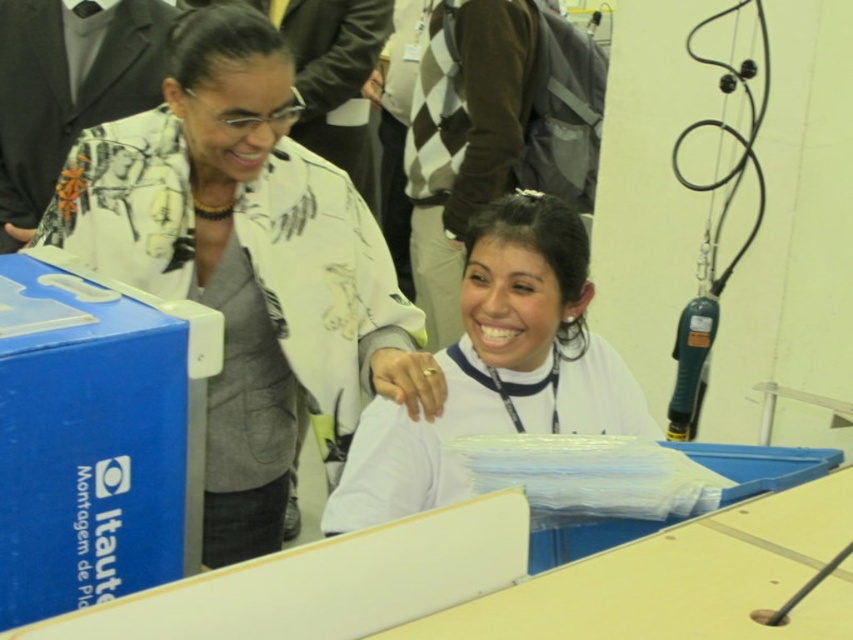
Question: Which point appears farthest from the camera in this image?

Choices:
 (A) (395, 499)
 (B) (173, 490)

Answer: (A)

Question: Does blue plastic box at lower left appear on the left side of white matte shirt at center?

Choices:
 (A) yes
 (B) no

Answer: (A)

Question: Where is blue plastic box at lower left located in relation to white matte shirt at center in the image?

Choices:
 (A) left
 (B) right

Answer: (A)

Question: Which point is closer to the camera taking this photo?

Choices:
 (A) (517, 314)
 (B) (199, 339)

Answer: (B)

Question: Can you confirm if blue plastic box at lower left is positioned above white matte shirt at center?

Choices:
 (A) yes
 (B) no

Answer: (A)